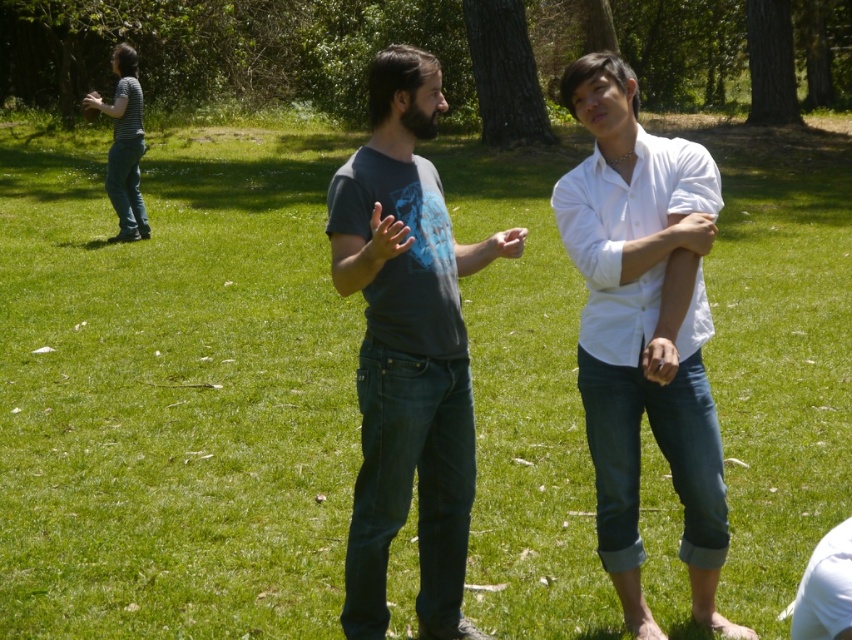
Which of these two, white cotton shirt at center or matte gray t-shirt at center, stands taller?

matte gray t-shirt at center

Where is `white cotton shirt at center`? This screenshot has width=852, height=640. white cotton shirt at center is located at coordinates (643, 330).